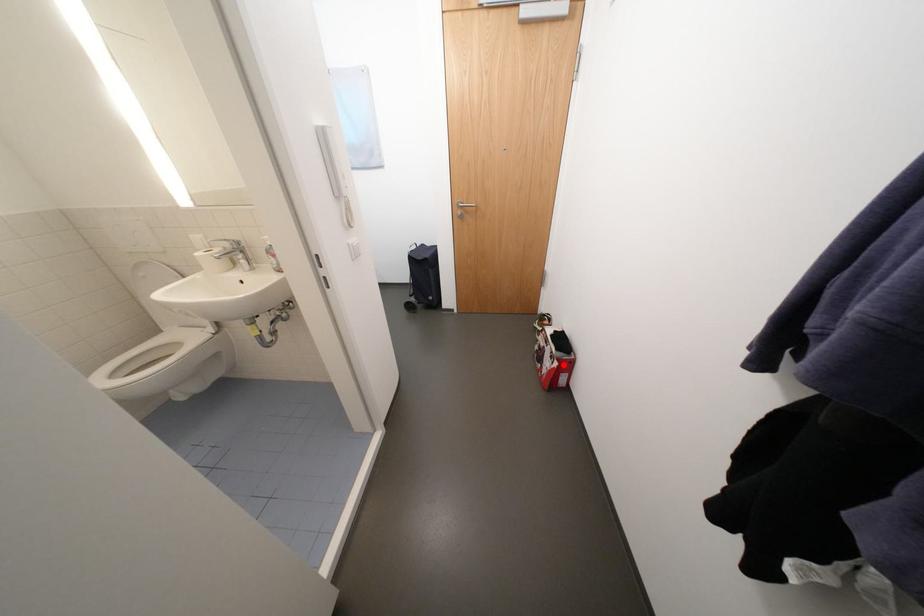
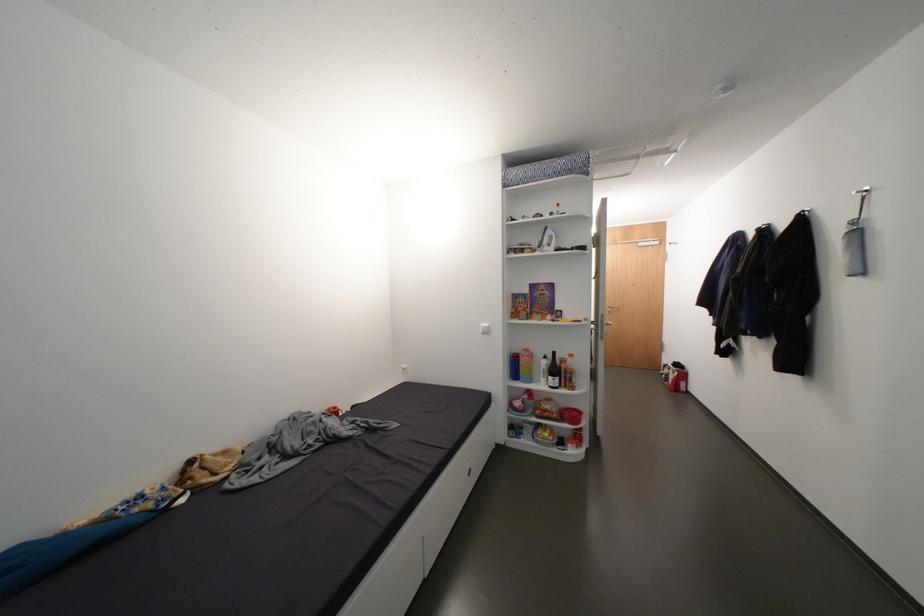
Locate, in the second image, the point that corresponds to the highlighted location in the first image.

(684, 374)